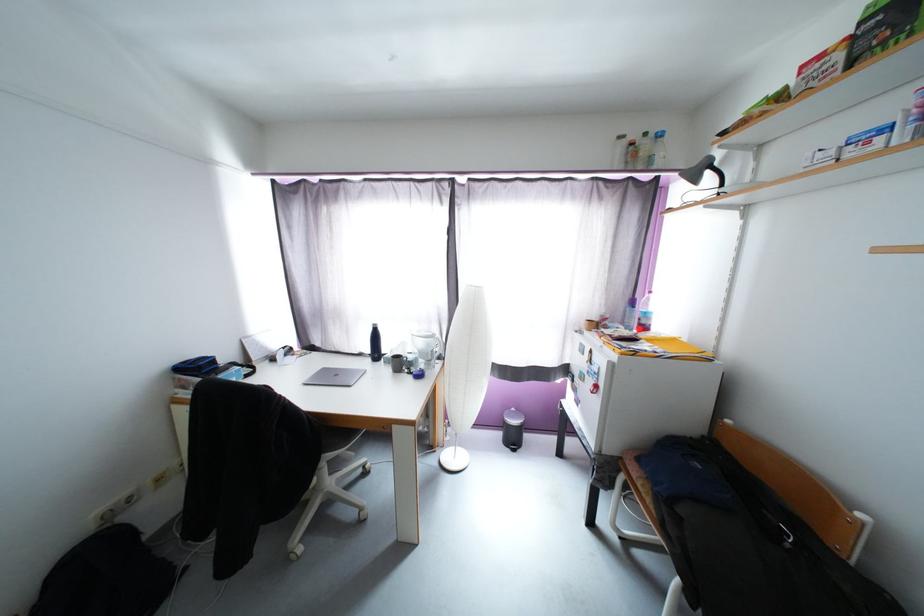
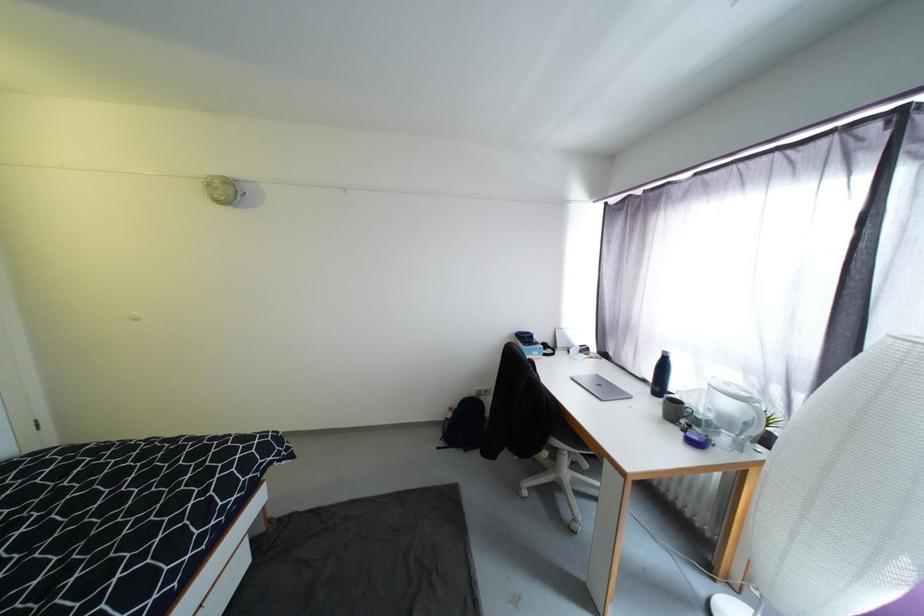
The point at (405,365) is marked in the first image. Where is the corresponding point in the second image?

(683, 413)